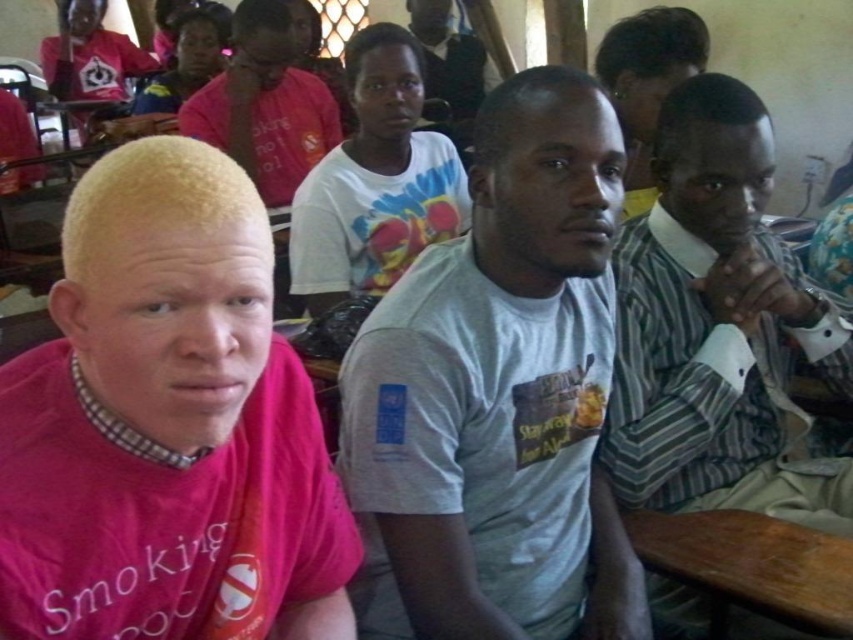
Does white matte t-shirt at center lie behind pink matte shirt at upper center?

No, it is not.

Is point (502, 97) more distant than point (267, 118)?

No, (502, 97) is closer to viewer.

Find the location of a particular element. white matte t-shirt at center is located at coordinates (498, 394).

Does striped fabric shirt at right appear under wooden table at lower right?

No, striped fabric shirt at right is not below wooden table at lower right.

Is striped fabric shirt at right shorter than wooden table at lower right?

No.

Is point (718, 488) farther from camera compared to point (820, 557)?

Yes, it is.

Find the location of a particular element. striped fabric shirt at right is located at coordinates (718, 330).

Measure the distance between pink matte shirt at left and camera.

A distance of 20.93 inches exists between pink matte shirt at left and camera.

Who is positioned more to the left, pink matte shirt at left or white matte t-shirt at center?

pink matte shirt at left is more to the left.

Between point (305, 400) and point (415, 556), which one is positioned behind?

The point (415, 556) is more distant.

I want to click on pink matte shirt at left, so click(x=163, y=419).